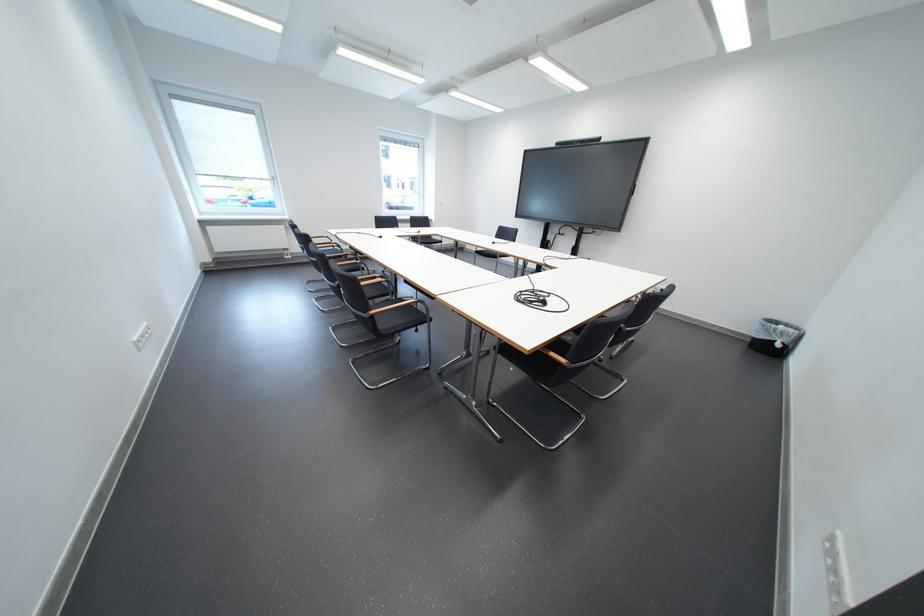
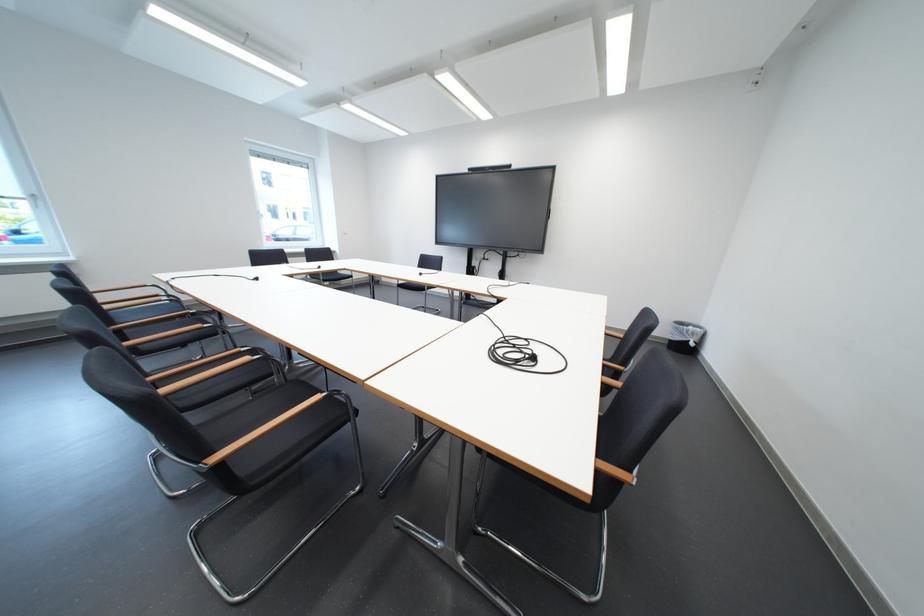
Where in the second image is the point corresponding to (780,333) from the first image?

(694, 334)